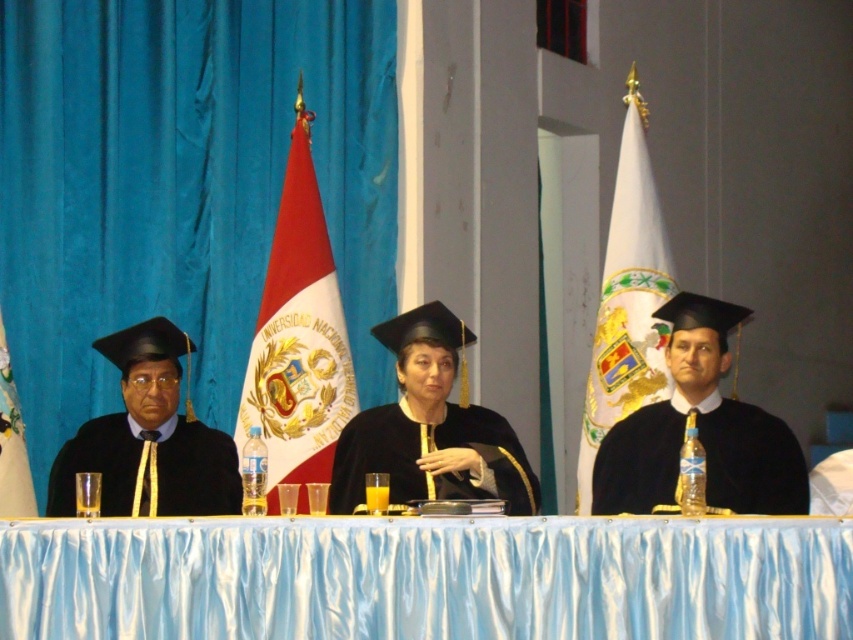
Between matte black graduation gown at center and white glossy flag at center, which one is positioned lower?

white glossy flag at center

Does matte black graduation gown at center have a larger size compared to white glossy flag at center?

Yes.

At what (x,y) coordinates should I click in order to perform the action: click on matte black graduation gown at center. Please return your answer as a coordinate pair (x, y). Looking at the image, I should click on (700, 429).

Image resolution: width=853 pixels, height=640 pixels. What are the coordinates of `matte black graduation gown at center` in the screenshot? It's located at (700, 429).

Which is above, silky blue tablecloth at center or matte black graduation gown at center?

matte black graduation gown at center is above.

Measure the distance from silky blue tablecloth at center to matte black graduation gown at center.

They are 10.24 meters apart.

The height and width of the screenshot is (640, 853). Identify the location of silky blue tablecloth at center. click(x=426, y=579).

Where is `silky blue tablecloth at center`? The image size is (853, 640). silky blue tablecloth at center is located at coordinates [426, 579].

Can you confirm if silky blue tablecloth at center is shorter than white fabric flag at left?

Indeed, silky blue tablecloth at center has a lesser height compared to white fabric flag at left.

Between silky blue tablecloth at center and white fabric flag at left, which one has more height?

With more height is white fabric flag at left.

Does point (779, 584) come in front of point (4, 468)?

Yes, point (779, 584) is closer to viewer.

Locate an element on the screen. The width and height of the screenshot is (853, 640). silky blue tablecloth at center is located at coordinates (426, 579).